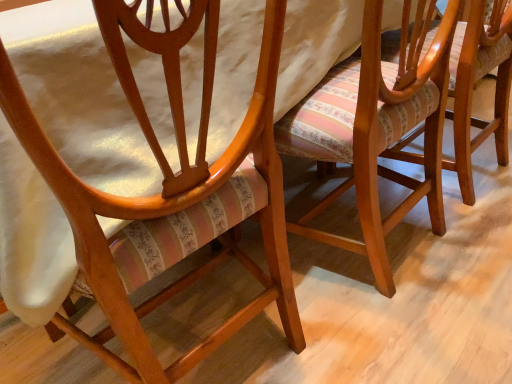
The height and width of the screenshot is (384, 512). Describe the element at coordinates (476, 83) in the screenshot. I see `striped fabric cushion at center, which ranks as the 1th chair in right-to-left order` at that location.

The height and width of the screenshot is (384, 512). What do you see at coordinates (376, 127) in the screenshot?
I see `wooden chair with striped upholstery at center, which is counted as the second chair, starting from the right` at bounding box center [376, 127].

Where is `wooden chair with striped upholstery at center, which is counted as the second chair, starting from the right`? The height and width of the screenshot is (384, 512). wooden chair with striped upholstery at center, which is counted as the second chair, starting from the right is located at coordinates [x=376, y=127].

Find the location of a particular element. striped fabric cushion at center, which ranks as the 1th chair in right-to-left order is located at coordinates [x=476, y=83].

Would you say striped fabric cushion at center, which ranks as the 1th chair in right-to-left order, is inside or outside wooden chair with striped upholstery at center, which ranks as the 2th chair in left-to-right order?

striped fabric cushion at center, which ranks as the 1th chair in right-to-left order, is not enclosed by wooden chair with striped upholstery at center, which ranks as the 2th chair in left-to-right order.

From the image's perspective, is striped fabric cushion at center, which ranks as the 1th chair in right-to-left order, below wooden chair with striped upholstery at center, which ranks as the 2th chair in left-to-right order?

Incorrect, from the image's perspective, striped fabric cushion at center, which ranks as the 1th chair in right-to-left order, is higher than wooden chair with striped upholstery at center, which ranks as the 2th chair in left-to-right order.

From a real-world perspective, which is physically above, striped fabric cushion at center, acting as the 3th chair starting from the left, or wooden chair with striped upholstery at center, which ranks as the 2th chair in left-to-right order?

In real-world perspective, wooden chair with striped upholstery at center, which ranks as the 2th chair in left-to-right order, is above.

Is striped fabric cushion at center, which ranks as the 1th chair in right-to-left order, oriented away from wooden chair with striped upholstery at center, which ranks as the 2th chair in left-to-right order?

striped fabric cushion at center, which ranks as the 1th chair in right-to-left order, does not have its back to wooden chair with striped upholstery at center, which ranks as the 2th chair in left-to-right order.

From the picture: From a real-world perspective, is wooden chair with striped upholstery at center, which ranks as the 2th chair in left-to-right order, physically below striped fabric cushion at center, which ranks as the 1th chair in right-to-left order?

No, from a real-world perspective, wooden chair with striped upholstery at center, which ranks as the 2th chair in left-to-right order, is not under striped fabric cushion at center, which ranks as the 1th chair in right-to-left order.

Could striped fabric cushion at center, acting as the 3th chair starting from the left, be considered to be inside wooden chair with striped upholstery at center, which ranks as the 2th chair in left-to-right order?

Actually, striped fabric cushion at center, acting as the 3th chair starting from the left, is outside wooden chair with striped upholstery at center, which ranks as the 2th chair in left-to-right order.

Starting from the striped fabric cushion at center, acting as the 3th chair starting from the left, which chair is the 1st one in front? Please provide its 2D coordinates.

[(376, 127)]

Could you tell me if wooden chair with striped upholstery at center, which ranks as the 2th chair in left-to-right order, is facing striped fabric cushion at center, acting as the 3th chair starting from the left?

No, wooden chair with striped upholstery at center, which ranks as the 2th chair in left-to-right order, is not aimed at striped fabric cushion at center, acting as the 3th chair starting from the left.

Is matte wood chair at center, marked as the 1th chair in a left-to-right arrangement, not within wooden chair with striped upholstery at center, which is counted as the second chair, starting from the right?

matte wood chair at center, marked as the 1th chair in a left-to-right arrangement, lies outside wooden chair with striped upholstery at center, which is counted as the second chair, starting from the right,'s area.

From a real-world perspective, is matte wood chair at center, the 3th chair positioned from the right, under wooden chair with striped upholstery at center, which is counted as the second chair, starting from the right?

Actually, matte wood chair at center, the 3th chair positioned from the right, is physically above wooden chair with striped upholstery at center, which is counted as the second chair, starting from the right, in the real world.

Where is `chair that is the 2nd one when counting upward from the matte wood chair at center, the 3th chair positioned from the right (from the image's perspective)`? chair that is the 2nd one when counting upward from the matte wood chair at center, the 3th chair positioned from the right (from the image's perspective) is located at coordinates (476, 83).

Which is more to the left, striped fabric cushion at center, which ranks as the 1th chair in right-to-left order, or matte wood chair at center, the 3th chair positioned from the right?

Positioned to the left is matte wood chair at center, the 3th chair positioned from the right.

From the image's perspective, is striped fabric cushion at center, acting as the 3th chair starting from the left, below matte wood chair at center, the 3th chair positioned from the right?

Incorrect, from the image's perspective, striped fabric cushion at center, acting as the 3th chair starting from the left, is higher than matte wood chair at center, the 3th chair positioned from the right.

Is striped fabric cushion at center, acting as the 3th chair starting from the left, not close to matte wood chair at center, the 3th chair positioned from the right?

No, striped fabric cushion at center, acting as the 3th chair starting from the left, is in close proximity to matte wood chair at center, the 3th chair positioned from the right.

From a real-world perspective, who is located higher, wooden chair with striped upholstery at center, which is counted as the second chair, starting from the right, or matte wood chair at center, the 3th chair positioned from the right?

matte wood chair at center, the 3th chair positioned from the right, is physically above.

Which object is thinner, wooden chair with striped upholstery at center, which is counted as the second chair, starting from the right, or matte wood chair at center, the 3th chair positioned from the right?

wooden chair with striped upholstery at center, which is counted as the second chair, starting from the right, is thinner.

Between wooden chair with striped upholstery at center, which is counted as the second chair, starting from the right, and matte wood chair at center, the 3th chair positioned from the right, which one has less height?

With less height is wooden chair with striped upholstery at center, which is counted as the second chair, starting from the right.

Are wooden chair with striped upholstery at center, which is counted as the second chair, starting from the right, and matte wood chair at center, marked as the 1th chair in a left-to-right arrangement, beside each other?

They are not placed beside each other.

Do you think matte wood chair at center, marked as the 1th chair in a left-to-right arrangement, is within striped fabric cushion at center, acting as the 3th chair starting from the left, or outside of it?

matte wood chair at center, marked as the 1th chair in a left-to-right arrangement, is located beyond the bounds of striped fabric cushion at center, acting as the 3th chair starting from the left.

From the picture: Does matte wood chair at center, marked as the 1th chair in a left-to-right arrangement, lie in front of striped fabric cushion at center, which ranks as the 1th chair in right-to-left order?

Yes, matte wood chair at center, marked as the 1th chair in a left-to-right arrangement, is closer to the camera.

The height and width of the screenshot is (384, 512). What are the coordinates of `chair that is the 2nd one when counting rightward from the matte wood chair at center, the 3th chair positioned from the right` in the screenshot? It's located at (476, 83).

Can you confirm if matte wood chair at center, marked as the 1th chair in a left-to-right arrangement, is bigger than striped fabric cushion at center, acting as the 3th chair starting from the left?

Indeed, matte wood chair at center, marked as the 1th chair in a left-to-right arrangement, has a larger size compared to striped fabric cushion at center, acting as the 3th chair starting from the left.

Image resolution: width=512 pixels, height=384 pixels. I want to click on chair that is the 1st object located below the striped fabric cushion at center, which ranks as the 1th chair in right-to-left order (from the image's perspective), so click(x=376, y=127).

Identify the location of chair above the wooden chair with striped upholstery at center, which is counted as the second chair, starting from the right (from the image's perspective). (476, 83).

When comparing their distances from striped fabric cushion at center, which ranks as the 1th chair in right-to-left order, does wooden chair with striped upholstery at center, which is counted as the second chair, starting from the right, or matte wood chair at center, the 3th chair positioned from the right, seem further?

matte wood chair at center, the 3th chair positioned from the right, is further to striped fabric cushion at center, which ranks as the 1th chair in right-to-left order.

From the image, which object appears to be farther from striped fabric cushion at center, acting as the 3th chair starting from the left, matte wood chair at center, the 3th chair positioned from the right, or wooden chair with striped upholstery at center, which ranks as the 2th chair in left-to-right order?

matte wood chair at center, the 3th chair positioned from the right, lies further to striped fabric cushion at center, acting as the 3th chair starting from the left, than the other object.

Based on their spatial positions, is striped fabric cushion at center, which ranks as the 1th chair in right-to-left order, or matte wood chair at center, marked as the 1th chair in a left-to-right arrangement, further from wooden chair with striped upholstery at center, which ranks as the 2th chair in left-to-right order?

matte wood chair at center, marked as the 1th chair in a left-to-right arrangement, is further to wooden chair with striped upholstery at center, which ranks as the 2th chair in left-to-right order.

From the image, which object appears to be farther from wooden chair with striped upholstery at center, which is counted as the second chair, starting from the right, matte wood chair at center, marked as the 1th chair in a left-to-right arrangement, or striped fabric cushion at center, acting as the 3th chair starting from the left?

Among the two, matte wood chair at center, marked as the 1th chair in a left-to-right arrangement, is located further to wooden chair with striped upholstery at center, which is counted as the second chair, starting from the right.

From the image, which object appears to be farther from matte wood chair at center, the 3th chair positioned from the right, wooden chair with striped upholstery at center, which is counted as the second chair, starting from the right, or striped fabric cushion at center, acting as the 3th chair starting from the left?

striped fabric cushion at center, acting as the 3th chair starting from the left.

Estimate the real-world distances between objects in this image. Which object is closer to matte wood chair at center, marked as the 1th chair in a left-to-right arrangement, striped fabric cushion at center, acting as the 3th chair starting from the left, or wooden chair with striped upholstery at center, which is counted as the second chair, starting from the right?

wooden chair with striped upholstery at center, which is counted as the second chair, starting from the right, lies closer to matte wood chair at center, marked as the 1th chair in a left-to-right arrangement, than the other object.

Locate an element on the screen. This screenshot has width=512, height=384. chair situated between matte wood chair at center, marked as the 1th chair in a left-to-right arrangement, and striped fabric cushion at center, acting as the 3th chair starting from the left, from left to right is located at coordinates (376, 127).